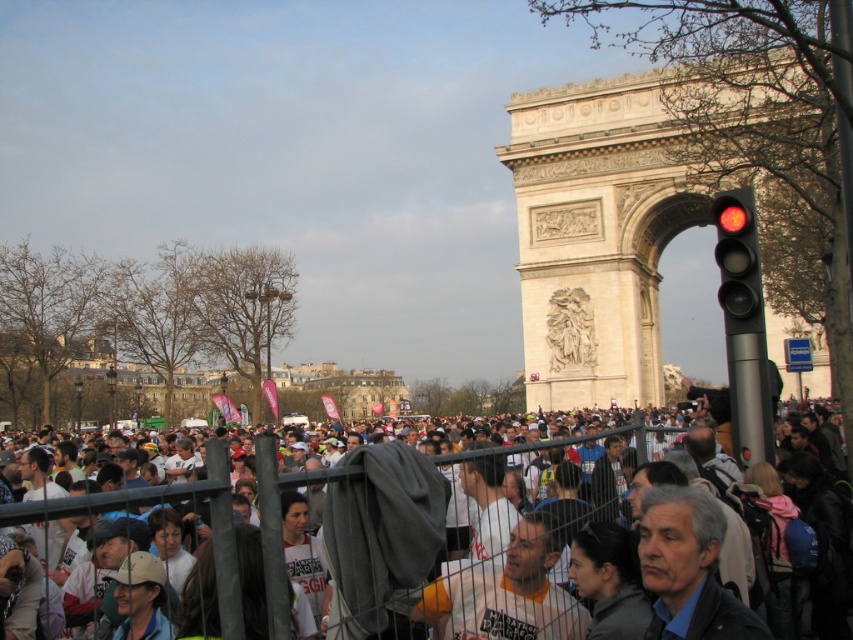
Question: Which of the following is the closest to the observer?

Choices:
 (A) red glass traffic light at right
 (B) white fabric at center

Answer: (B)

Question: Does white fabric at center have a greater width compared to red glass traffic light at right?

Choices:
 (A) yes
 (B) no

Answer: (A)

Question: Which of the following is the closest to the observer?

Choices:
 (A) (387, 554)
 (B) (728, 205)

Answer: (A)

Question: Considering the relative positions of white fabric at center and red glass traffic light at right in the image provided, where is white fabric at center located with respect to red glass traffic light at right?

Choices:
 (A) below
 (B) above

Answer: (A)

Question: Does white fabric at center appear over red glass traffic light at right?

Choices:
 (A) yes
 (B) no

Answer: (B)

Question: Which object appears closest to the camera in this image?

Choices:
 (A) red glass traffic light at right
 (B) white fabric at center

Answer: (B)